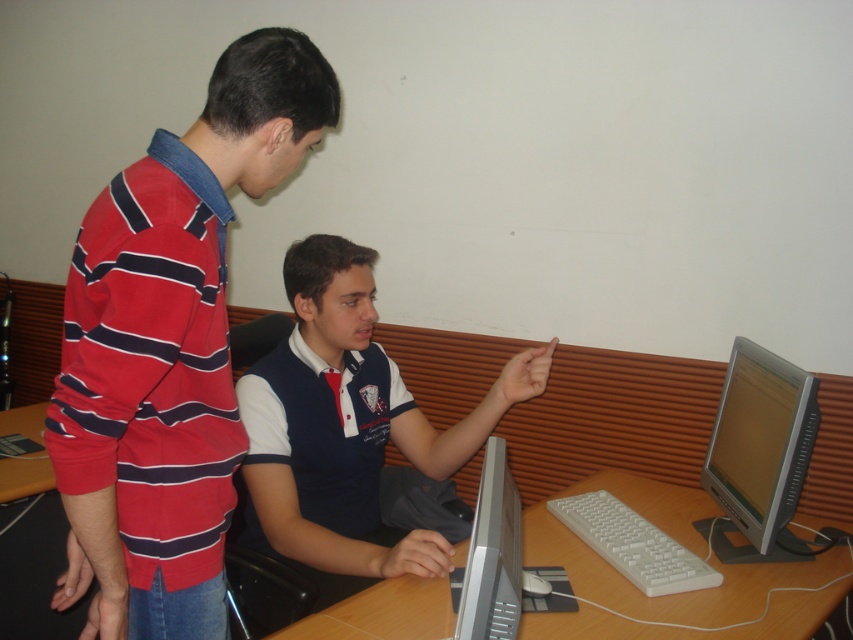
Question: Which point is farther from the camera taking this photo?

Choices:
 (A) (473, 573)
 (B) (102, 513)
 (C) (769, 392)
 (D) (33, 413)

Answer: (D)

Question: Which point is farther from the camera taking this photo?

Choices:
 (A) (283, 412)
 (B) (701, 624)

Answer: (A)

Question: Which is nearer to the wooden desk at center?

Choices:
 (A) silver metallic monitor at right
 (B) satin silver monitor at lower center
 (C) white plastic keyboard at lower center

Answer: (C)

Question: Is silver metallic monitor at right thinner than satin silver monitor at lower center?

Choices:
 (A) no
 (B) yes

Answer: (A)

Question: From the image, what is the correct spatial relationship of navy blue jersey at center in relation to wooden desk at center?

Choices:
 (A) left
 (B) right

Answer: (A)

Question: Is wooden desk at center below silver metallic monitor at right?

Choices:
 (A) no
 (B) yes

Answer: (B)